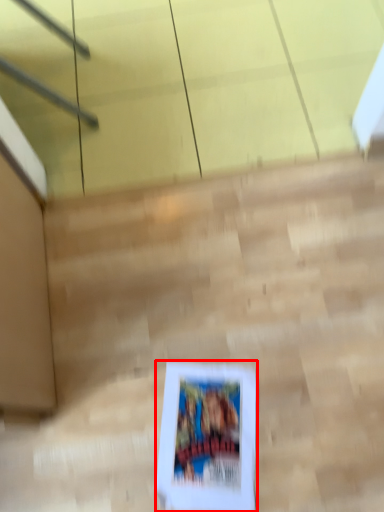
Question: Where is picture frame (annotated by the red box) located in relation to stairwell in the image?

Choices:
 (A) left
 (B) right

Answer: (A)